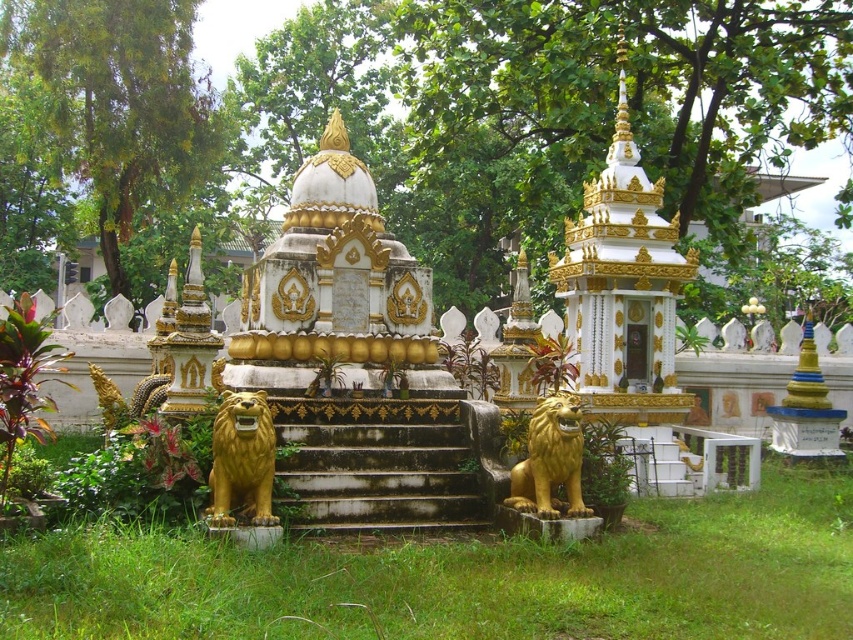
Question: Among these points, which one is nearest to the camera?

Choices:
 (A) (521, 509)
 (B) (265, 444)
 (C) (315, 467)

Answer: (B)

Question: Based on their relative distances, which object is farther from the gold polished stone lion at lower left?

Choices:
 (A) stone stairs at center
 (B) gold polished lion at lower center

Answer: (A)

Question: Among these objects, which one is farthest from the camera?

Choices:
 (A) gold polished stone lion at lower left
 (B) stone stairs at center
 (C) gold polished lion at lower center

Answer: (B)

Question: Considering the relative positions of stone stairs at center and gold polished lion at lower center in the image provided, where is stone stairs at center located with respect to gold polished lion at lower center?

Choices:
 (A) right
 (B) left

Answer: (B)

Question: Does gold polished stone lion at lower left appear on the right side of gold polished lion at lower center?

Choices:
 (A) yes
 (B) no

Answer: (B)

Question: Is stone stairs at center below gold polished lion at lower center?

Choices:
 (A) yes
 (B) no

Answer: (A)